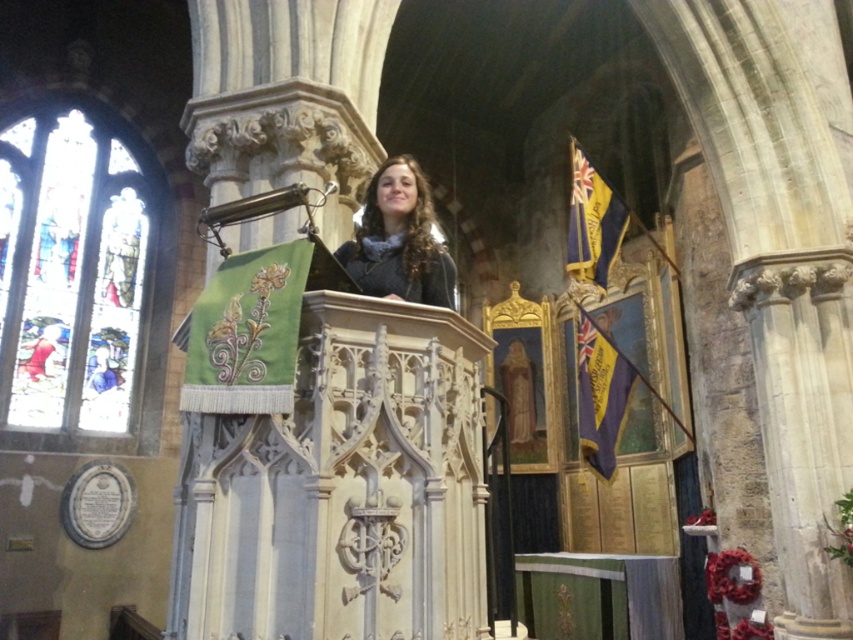
Looking at this image, you are standing inside the historic church and want to take a photo of the stained glass window at left and the gray wool scarf at center. Which object should you focus on first to ensure it appears sharp in your photo?

You should focus on the stained glass window at left first because it is closer to you than the gray wool scarf at center, so adjusting focus starting from the closer object ensures both are in focus.